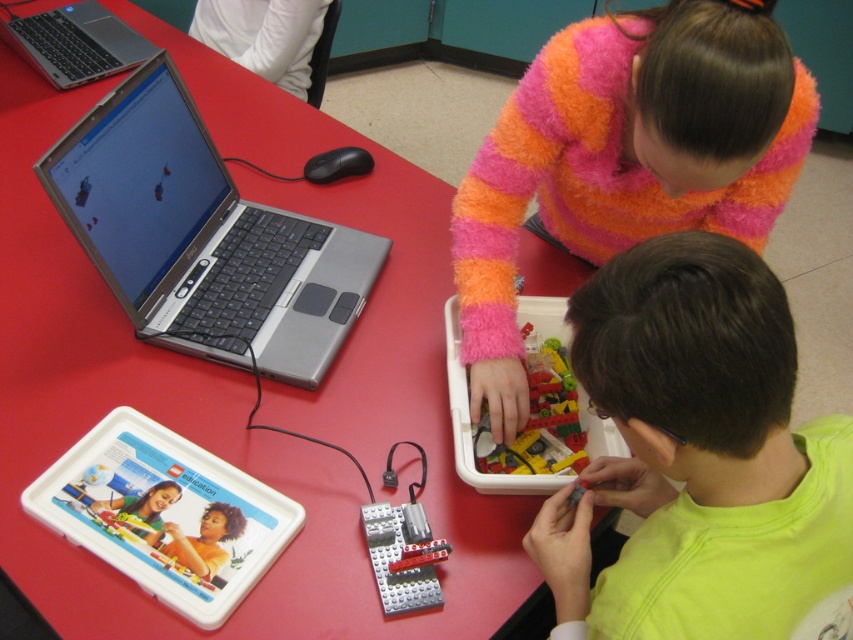
Question: Which object appears farthest from the camera in this image?

Choices:
 (A) translucent plastic lego bricks at center
 (B) fluffy pink-orange sweater at upper center

Answer: (A)

Question: Estimate the real-world distances between objects in this image. Which object is closer to the translucent plastic lego bricks at center?

Choices:
 (A) bright green fabric at lower right
 (B) red plastic table at center

Answer: (A)

Question: Is bright green fabric at lower right above silver metallic laptop at upper left?

Choices:
 (A) no
 (B) yes

Answer: (A)

Question: Which object is positioned farthest from the red plastic table at center?

Choices:
 (A) translucent plastic lego bricks at center
 (B) bright green fabric at lower right
 (C) fluffy pink-orange sweater at upper center
 (D) silver metallic laptop at upper left

Answer: (B)

Question: Considering the relative positions of silver metallic laptop at left and translucent plastic lego bricks at center in the image provided, where is silver metallic laptop at left located with respect to translucent plastic lego bricks at center?

Choices:
 (A) above
 (B) below

Answer: (A)

Question: Does bright green fabric at lower right appear on the left side of fluffy pink-orange sweater at upper center?

Choices:
 (A) no
 (B) yes

Answer: (B)